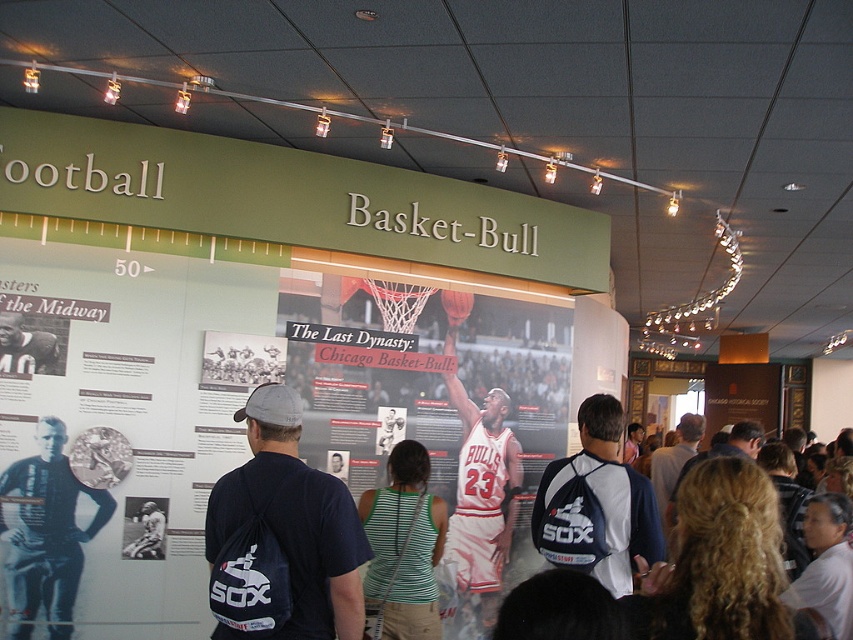
Can you confirm if matte basketball jersey at center is positioned above dark blue t-shirt at center?

No.

How distant is matte basketball jersey at center from dark blue t-shirt at center?

matte basketball jersey at center is 8.70 feet from dark blue t-shirt at center.

What do you see at coordinates (233, 406) in the screenshot? I see `matte basketball jersey at center` at bounding box center [233, 406].

The width and height of the screenshot is (853, 640). What are the coordinates of `matte basketball jersey at center` in the screenshot? It's located at (233, 406).

Is dark blue t-shirt at center above white matte basketball at center?

Actually, dark blue t-shirt at center is below white matte basketball at center.

Measure the distance from dark blue t-shirt at center to white matte basketball at center.

dark blue t-shirt at center is 10.40 feet from white matte basketball at center.

Is point (329, 540) more distant than point (462, 296)?

No, (329, 540) is in front of (462, 296).

Identify the location of dark blue t-shirt at center. (289, 524).

Does black leather jacket at left have a smaller size compared to white shirt at center?

Yes.

What do you see at coordinates (45, 534) in the screenshot?
I see `black leather jacket at left` at bounding box center [45, 534].

I want to click on black leather jacket at left, so click(45, 534).